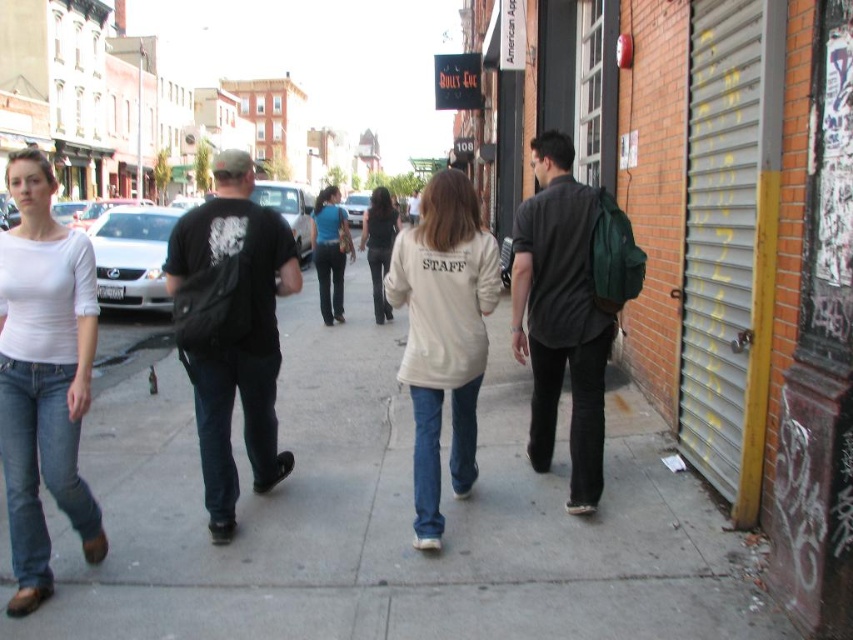
Based on the photo, you are standing at the entrance of the Bullseye store and want to walk to the American Apparel store. According to the image, which direction should you walk relative to the gray concrete sidewalk at center?

The gray concrete sidewalk at center is located at point [389,518], so you should walk towards the gray concrete sidewalk at center to reach the American Apparel store from the Bullseye store.

You are standing on the sidewalk in the urban street scene. There are two points marked in the image. One is at coordinates point (223,465) and the other at point (383,294). Which point is nearer to you?

Point (223,465) is closer to the viewer than point (383,294).